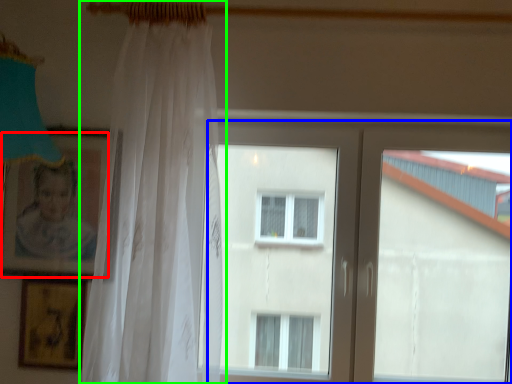
Question: Based on their relative distances, which object is farther from picture frame (highlighted by a red box)? Choose from window (highlighted by a blue box) and curtain (highlighted by a green box).

Choices:
 (A) window
 (B) curtain

Answer: (A)